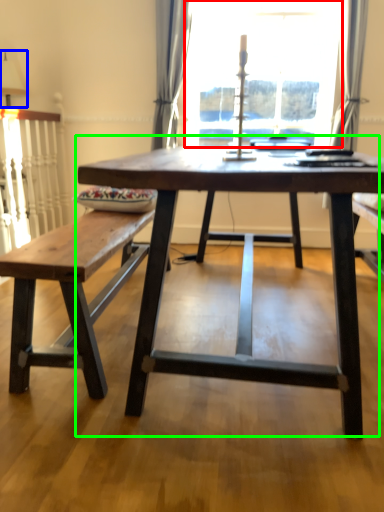
Question: Which object is the closest to the window screen (highlighted by a red box)? Choose among these: table lamp (highlighted by a blue box) or coffee table (highlighted by a green box).

Choices:
 (A) table lamp
 (B) coffee table

Answer: (A)